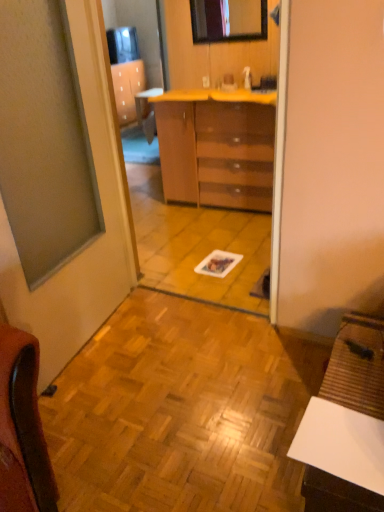
Locate an element on the screen. The width and height of the screenshot is (384, 512). vacant space to the right of matte glass window at left is located at coordinates (187, 348).